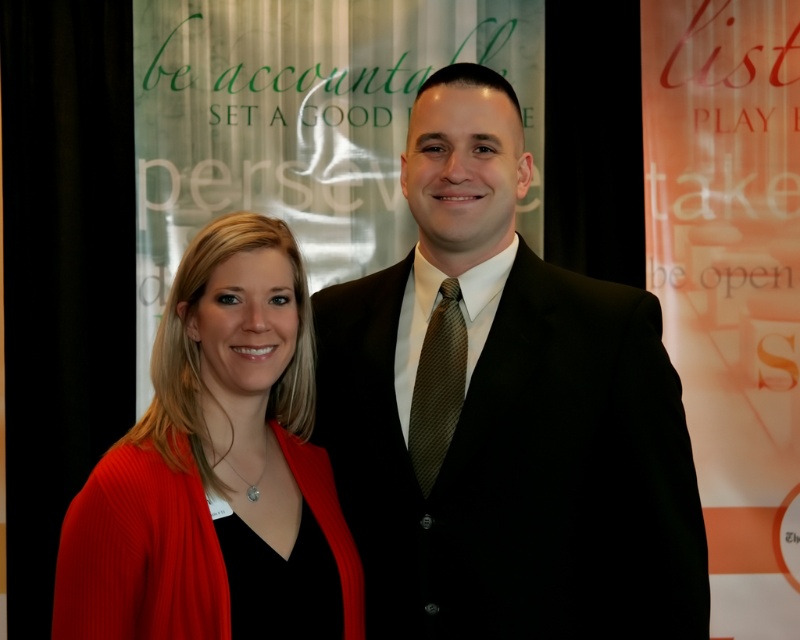
From the picture: Between knitted red cardigan at left and brown textured tie at center, which one has more height?

knitted red cardigan at left is taller.

You are a GUI agent. You are given a task and a screenshot of the screen. Output one action in this format:
    pyautogui.click(x=<x>, y=<y>)
    Task: Click on the knitted red cardigan at left
    
    Given the screenshot: What is the action you would take?
    pyautogui.click(x=214, y=474)

In the scene shown: Who is shorter, black suit at center or knitted red cardigan at left?

knitted red cardigan at left is shorter.

Does black suit at center appear on the left side of knitted red cardigan at left?

In fact, black suit at center is to the right of knitted red cardigan at left.

Measure the distance between point (x=578, y=449) and camera.

The distance of point (x=578, y=449) from camera is 1.64 meters.

Where is `black suit at center`? The width and height of the screenshot is (800, 640). black suit at center is located at coordinates (504, 412).

Describe the element at coordinates (504, 412) in the screenshot. I see `black suit at center` at that location.

Is black suit at center wider than brown textured tie at center?

Yes.

Is point (318, 346) farther from camera compared to point (412, 451)?

That is True.

Where is `black suit at center`? The image size is (800, 640). black suit at center is located at coordinates (504, 412).